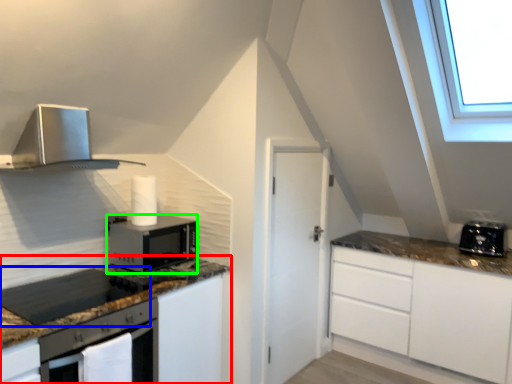
Question: Based on their relative distances, which object is farther from cabinetry (highlighted by a red box)? Choose from gas stove (highlighted by a blue box) and microwave oven (highlighted by a green box).

Choices:
 (A) gas stove
 (B) microwave oven

Answer: (B)